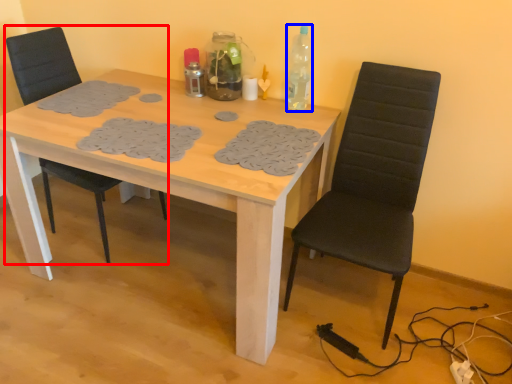
Question: Which point is further to the camera, chair (highlighted by a red box) or bottle (highlighted by a blue box)?

Choices:
 (A) chair
 (B) bottle

Answer: (B)